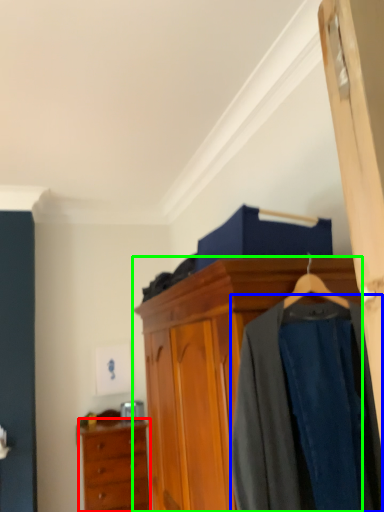
Question: Considering the real-world distances, which object is closest to chest of drawers (highlighted by a red box)? clothing (highlighted by a blue box) or cabinetry (highlighted by a green box).

Choices:
 (A) clothing
 (B) cabinetry

Answer: (B)